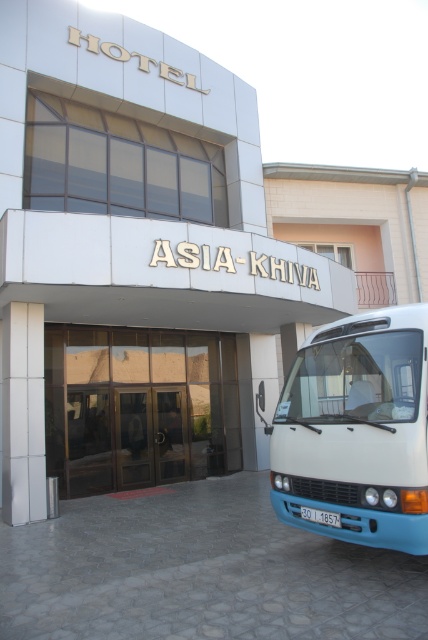
Question: Which point is farther to the camera?

Choices:
 (A) (330, 326)
 (B) (51, 340)

Answer: (B)

Question: Considering the relative positions of white glossy van at right and shiny glass doors at center in the image provided, where is white glossy van at right located with respect to shiny glass doors at center?

Choices:
 (A) above
 (B) below

Answer: (A)

Question: Among these points, which one is nearest to the camera?

Choices:
 (A) (83, 340)
 (B) (332, 436)

Answer: (B)

Question: Is white glossy van at right to the left of shiny glass doors at center from the viewer's perspective?

Choices:
 (A) yes
 (B) no

Answer: (B)

Question: Does white glossy van at right have a smaller size compared to shiny glass doors at center?

Choices:
 (A) yes
 (B) no

Answer: (A)